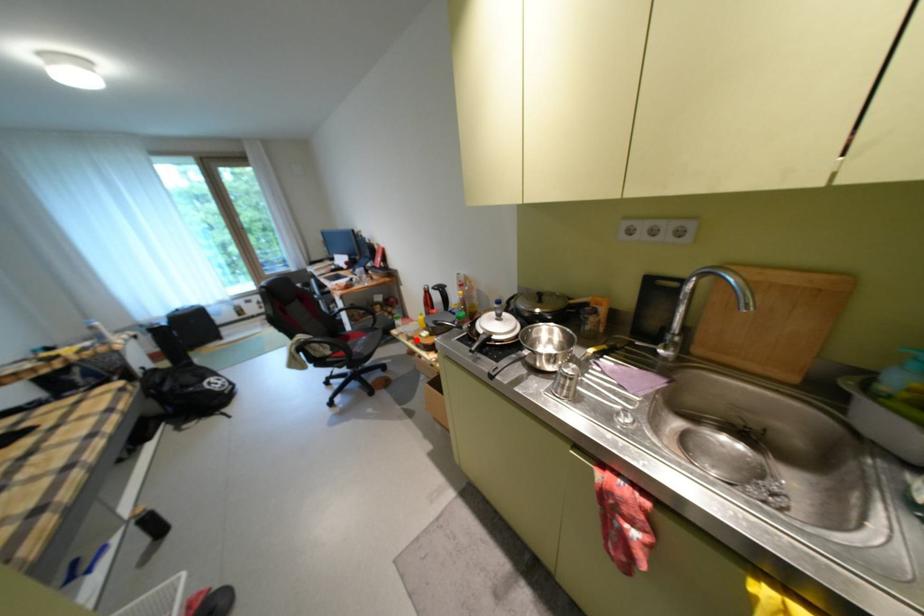
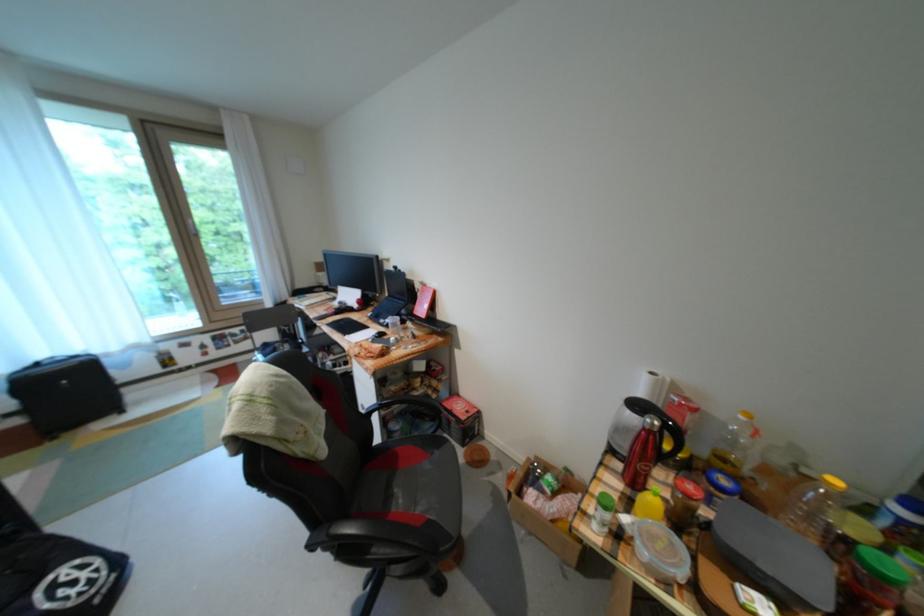
Where in the second image is the point corresponding to the highlighted location from the first image?

(664, 582)